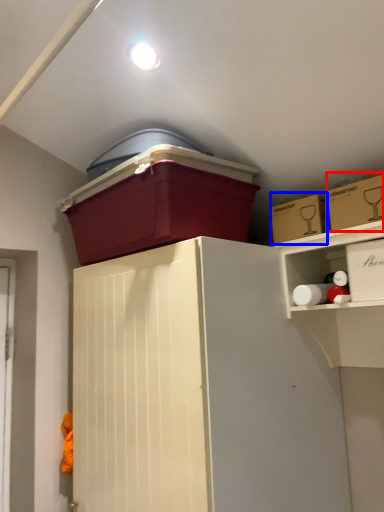
Question: Which point is further to the camera, storage box (highlighted by a red box) or storage box (highlighted by a blue box)?

Choices:
 (A) storage box
 (B) storage box

Answer: (B)